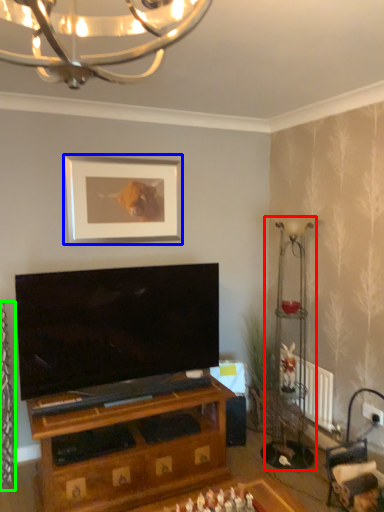
Question: Which is nearer to the lamp (highlighted by a red box)? picture frame (highlighted by a blue box) or curtain (highlighted by a green box).

Choices:
 (A) picture frame
 (B) curtain

Answer: (A)